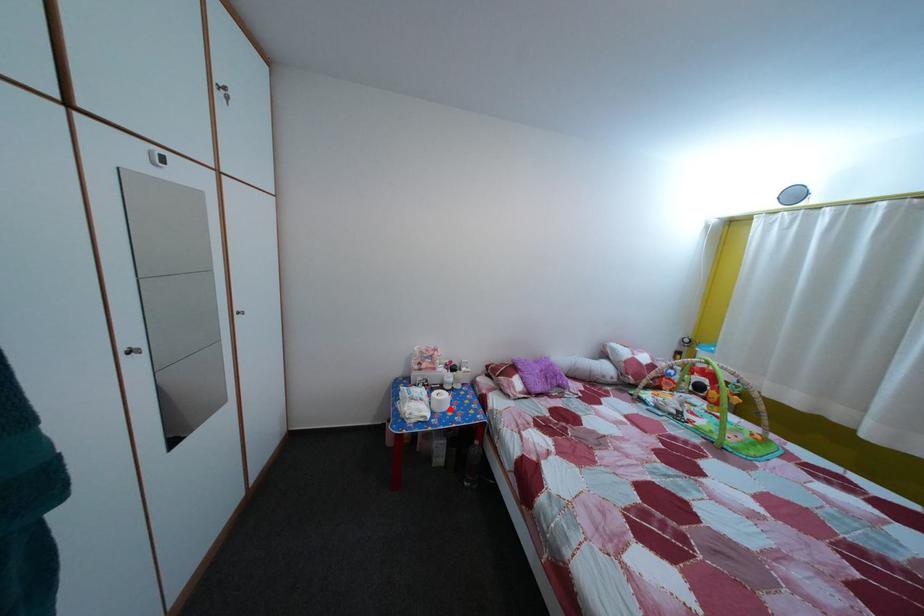
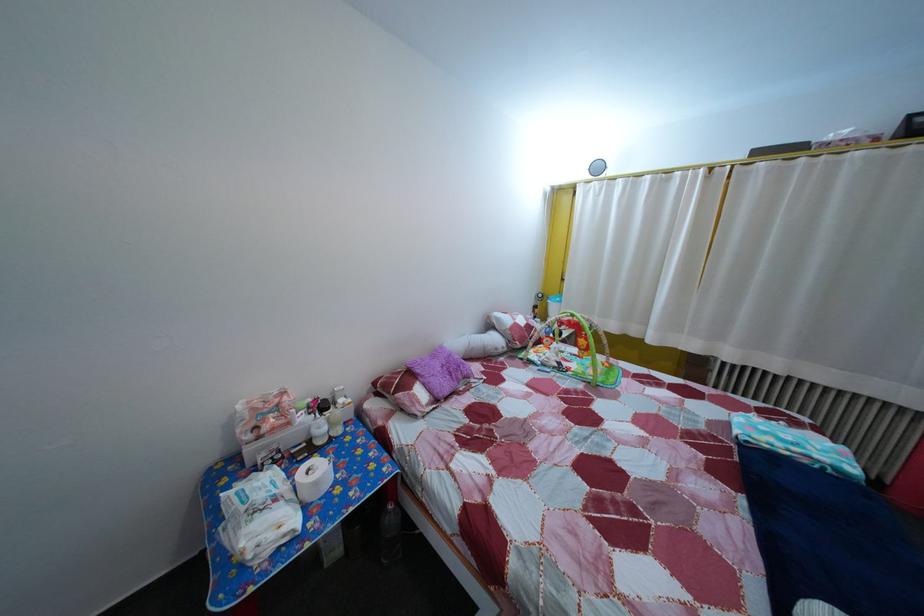
Question: I am providing you with two images of the same scene from different viewpoints. Image1 has a red point marked. In image2, the corresponding 3D location appears at what relative position? Reply with the corresponding letter.

Choices:
 (A) Closer
 (B) Farther

Answer: (A)